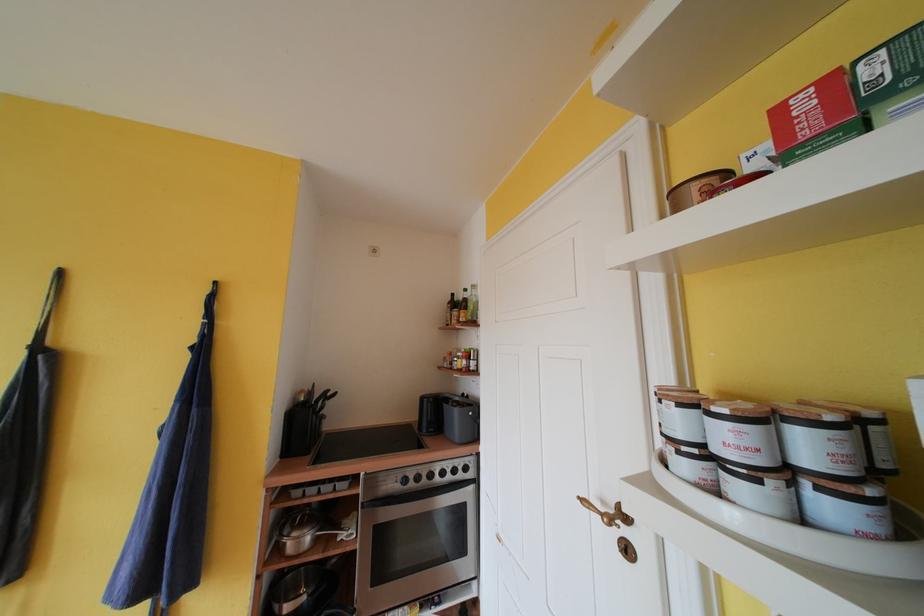
Where would you lift the white oval tray? Please return your answer as a coordinate pair (x, y).

(809, 532)